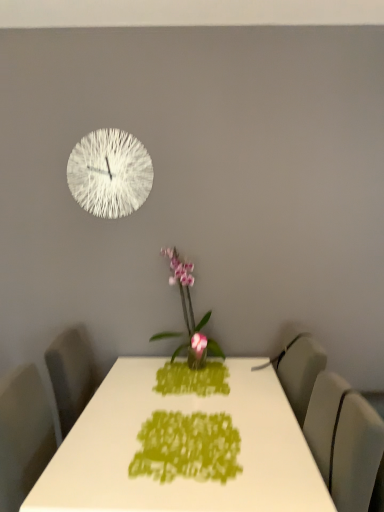
The height and width of the screenshot is (512, 384). In order to click on vacant space positioned to the left of green fabric placemat at center in this screenshot , I will do `click(95, 443)`.